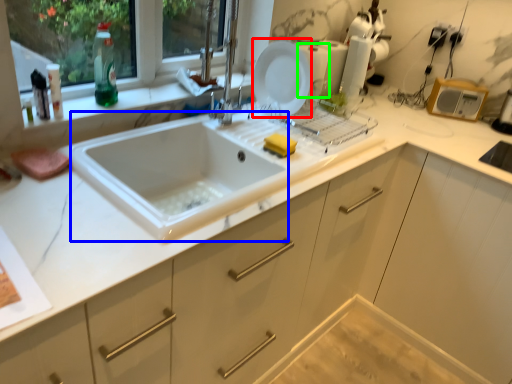
Question: Which object is positioned closest to plate (highlighted by a red box)? Select from sink (highlighted by a blue box) and appliance (highlighted by a green box).

Choices:
 (A) sink
 (B) appliance

Answer: (B)